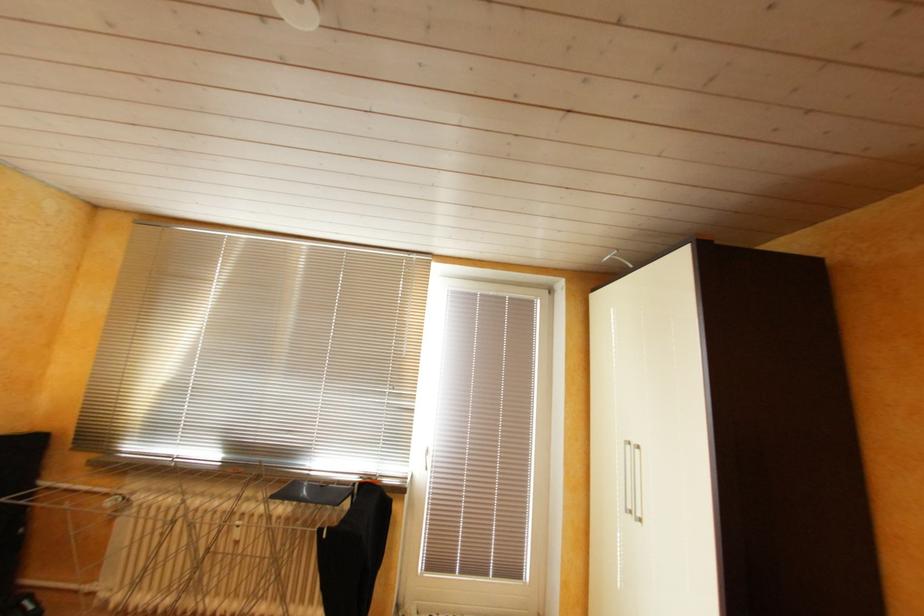
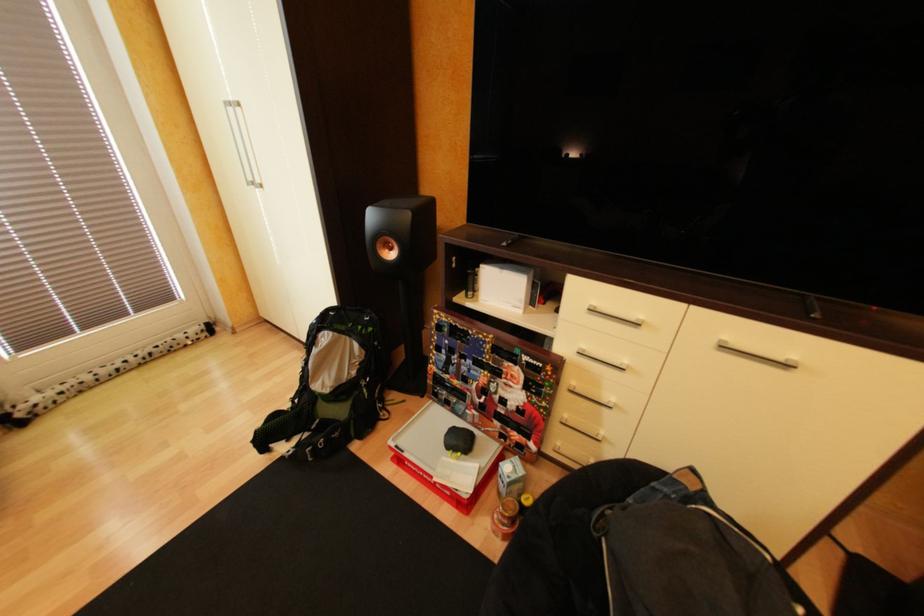
The first image is from the beginning of the video and the second image is from the end. How did the camera likely rotate when shooting the video?

The rotation direction of the camera is right-down.